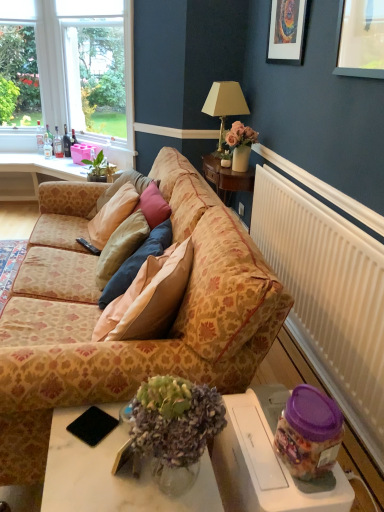
Find the location of `free location to the right of black matte pad at lower left`. free location to the right of black matte pad at lower left is located at coordinates (126, 456).